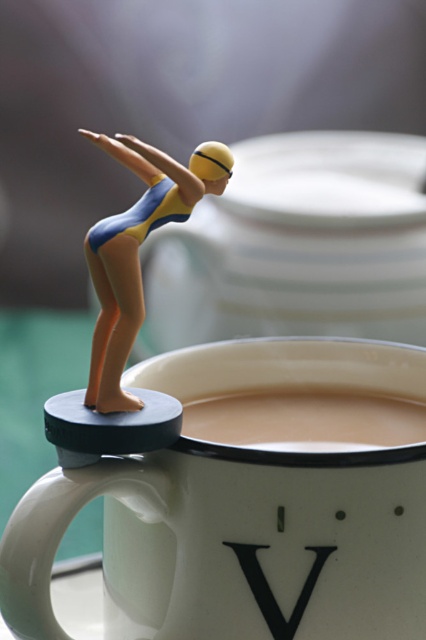
Question: Is matte plastic diver at upper left closer to camera compared to black matte letter v at upper center?

Choices:
 (A) no
 (B) yes

Answer: (B)

Question: Which of these objects is positioned farthest from the creamy matte coffee at center?

Choices:
 (A) matte plastic diver at upper left
 (B) black matte letter v at upper center

Answer: (A)

Question: Which point appears farthest from the camera in this image?

Choices:
 (A) (301, 608)
 (B) (123, 285)
 (C) (215, 419)
 (D) (201, 545)

Answer: (C)

Question: Estimate the real-world distances between objects in this image. Which object is closer to the creamy matte coffee at center?

Choices:
 (A) white ceramic mug at upper center
 (B) black matte letter v at upper center
 (C) matte plastic diver at upper left

Answer: (A)

Question: Can you confirm if white ceramic mug at upper center is bigger than matte plastic diver at upper left?

Choices:
 (A) no
 (B) yes

Answer: (B)

Question: Is matte plastic diver at upper left in front of creamy matte coffee at center?

Choices:
 (A) yes
 (B) no

Answer: (A)